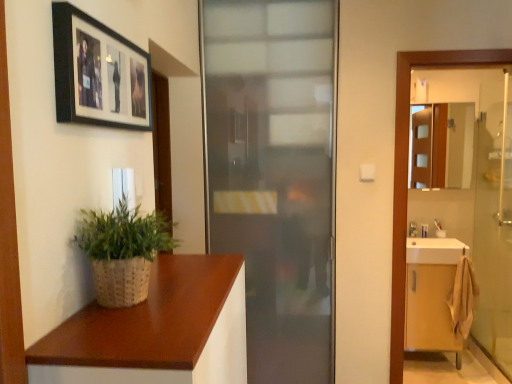
The width and height of the screenshot is (512, 384). What are the coordinates of `free location in front of woven natural plant at lower left` in the screenshot? It's located at (114, 336).